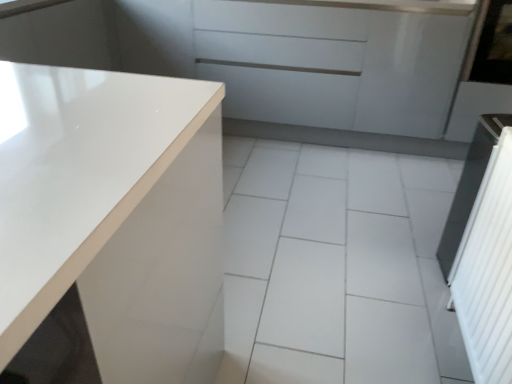
Question: From a real-world perspective, is white glossy countertop at left physically above white glossy tile at center?

Choices:
 (A) yes
 (B) no

Answer: (A)

Question: Considering the relative positions of white glossy countertop at left and white glossy tile at center in the image provided, is white glossy countertop at left to the left of white glossy tile at center from the viewer's perspective?

Choices:
 (A) yes
 (B) no

Answer: (A)

Question: Is white glossy countertop at left shorter than white glossy tile at center?

Choices:
 (A) no
 (B) yes

Answer: (A)

Question: Could you tell me if white glossy countertop at left is facing white glossy tile at center?

Choices:
 (A) no
 (B) yes

Answer: (B)

Question: Is white glossy countertop at left positioned behind white glossy tile at center?

Choices:
 (A) yes
 (B) no

Answer: (B)

Question: In terms of height, does transparent glass window screen at upper right look taller or shorter compared to glossy white cabinet at upper center?

Choices:
 (A) tall
 (B) short

Answer: (B)

Question: Is transparent glass window screen at upper right spatially inside glossy white cabinet at upper center, or outside of it?

Choices:
 (A) inside
 (B) outside

Answer: (B)

Question: Is transparent glass window screen at upper right in front of or behind glossy white cabinet at upper center in the image?

Choices:
 (A) front
 (B) behind

Answer: (A)

Question: From a real-world perspective, relative to glossy white cabinet at upper center, is transparent glass window screen at upper right vertically above or below?

Choices:
 (A) below
 (B) above

Answer: (B)

Question: Does point (375, 89) appear closer or farther from the camera than point (455, 105)?

Choices:
 (A) closer
 (B) farther

Answer: (B)

Question: From a real-world perspective, relative to glossy white screen door at right, the 2th screen door when ordered from front to back, is glossy white cabinet at upper center vertically above or below?

Choices:
 (A) below
 (B) above

Answer: (A)

Question: Would you say glossy white cabinet at upper center is inside or outside glossy white screen door at right, placed as the 1th screen door when sorted from top to bottom?

Choices:
 (A) outside
 (B) inside

Answer: (A)

Question: Based on their positions, is glossy white cabinet at upper center located to the left or right of glossy white screen door at right, arranged as the first screen door when viewed from the right?

Choices:
 (A) left
 (B) right

Answer: (A)

Question: From the image's perspective, is glossy white screen door at right, acting as the first screen door starting from the back, located above or below white glossy countertop at left?

Choices:
 (A) above
 (B) below

Answer: (A)

Question: Is glossy white screen door at right, which is counted as the second screen door, starting from the left, situated inside white glossy countertop at left or outside?

Choices:
 (A) outside
 (B) inside

Answer: (A)